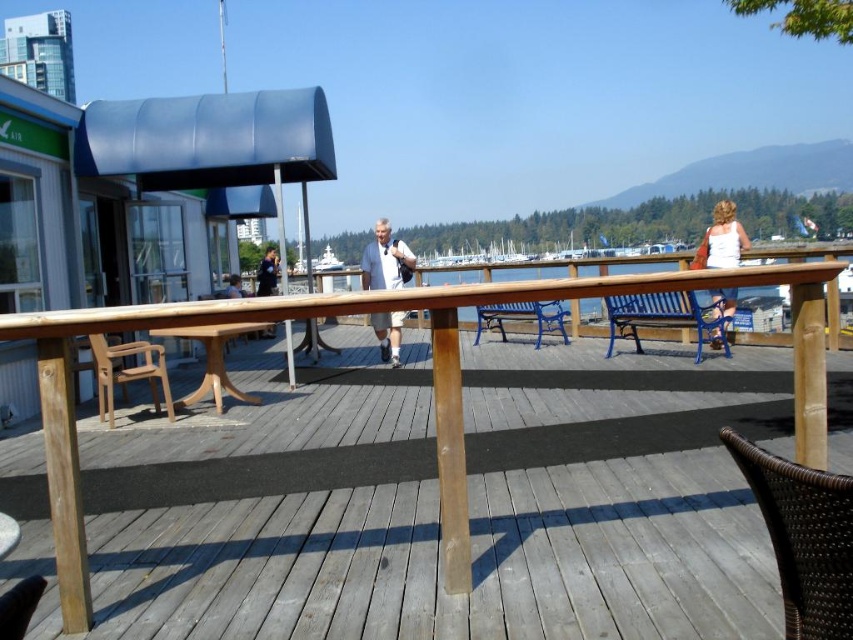
Question: Can you confirm if brown woven chair at lower right is positioned below blue metal bench at center?

Choices:
 (A) no
 (B) yes

Answer: (B)

Question: Among these objects, which one is farthest from the camera?

Choices:
 (A) wooden chair at left
 (B) white fabric dress at upper right

Answer: (A)

Question: Which point is farther to the camera?

Choices:
 (A) (209, 433)
 (B) (395, 282)
 (C) (775, 500)

Answer: (B)

Question: Which of the following is the closest to the observer?

Choices:
 (A) wooden chair at left
 (B) white fabric dress at upper right
 (C) white cotton shirt at center

Answer: (B)

Question: Can you confirm if brown woven chair at lower right is bigger than metallic blue bench at center?

Choices:
 (A) no
 (B) yes

Answer: (A)

Question: In this image, where is brown woven chair at lower right located relative to blue metal bench at center?

Choices:
 (A) left
 (B) right

Answer: (A)